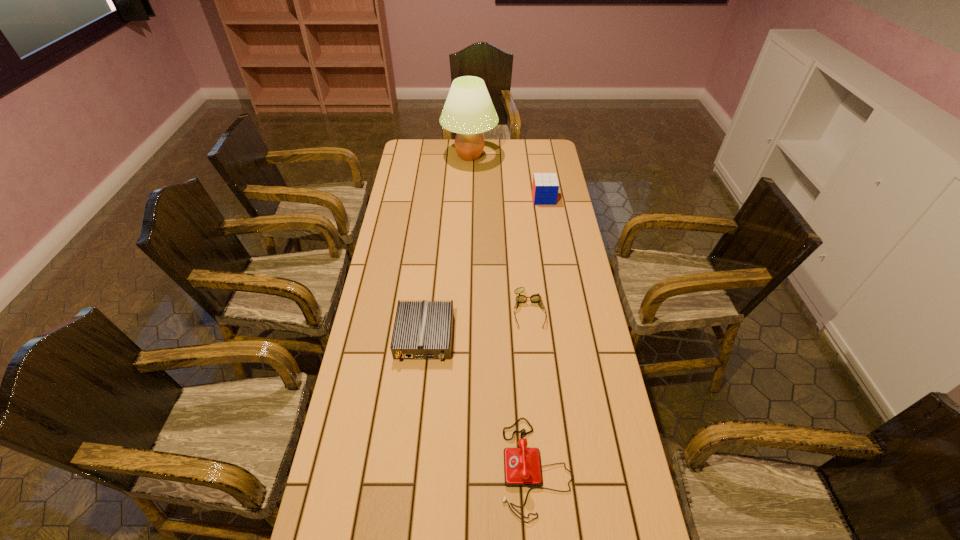
Find the location of a particular element. The width and height of the screenshot is (960, 540). blank area in the image that satisfies the following two spatial constraints: 1. on the back side of the fourth nearest object; 2. on the shade of the lampshade is located at coordinates (537, 156).